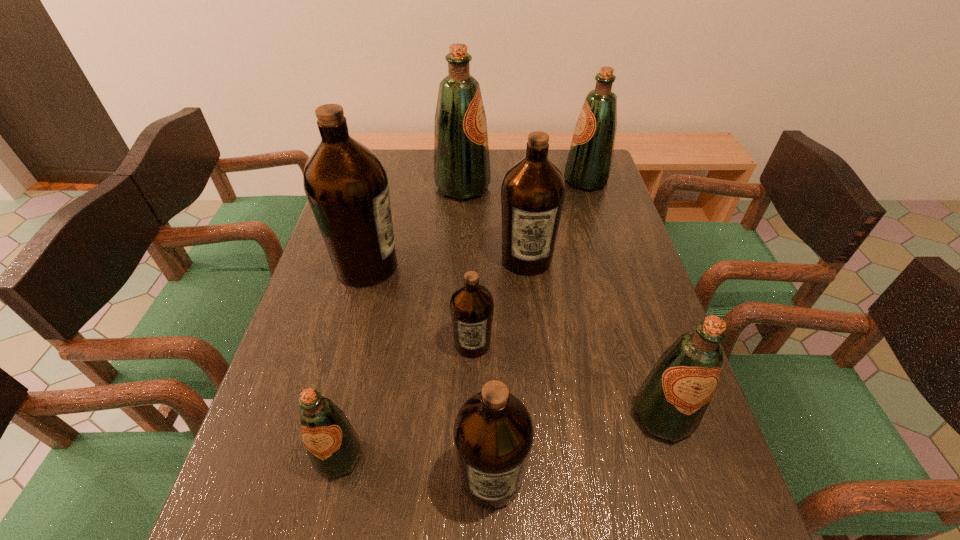
The height and width of the screenshot is (540, 960). What are the coordinates of `the biggest green olive oil` in the screenshot? It's located at (461, 153).

You are a GUI agent. You are given a task and a screenshot of the screen. Output one action in this format:
    pyautogui.click(x=<x>, y=<y>)
    Task: Click on the biggest brown olive oil
    The image size is (960, 540).
    Given the screenshot: What is the action you would take?
    pyautogui.click(x=345, y=182)

The height and width of the screenshot is (540, 960). Identify the location of the third smallest brown olive oil. (533, 191).

Find the location of a particular element. the third smallest green olive oil is located at coordinates (588, 167).

Where is `the nearest brown olive oil`? This screenshot has height=540, width=960. the nearest brown olive oil is located at coordinates (493, 432).

In order to click on the third biggest green olive oil in this screenshot , I will do `click(671, 402)`.

Where is `the smallest brown olive oil`? the smallest brown olive oil is located at coordinates (471, 305).

Where is `the third farthest brown olive oil`? the third farthest brown olive oil is located at coordinates (471, 305).

Image resolution: width=960 pixels, height=540 pixels. In order to click on the smallest green olive oil in this screenshot , I will do `click(333, 446)`.

You are a GUI agent. You are given a task and a screenshot of the screen. Output one action in this format:
    pyautogui.click(x=<x>, y=<y>)
    Task: Click on the vacant region located on the front-facing side of the second green olive oil from left to right
    
    Given the screenshot: What is the action you would take?
    point(576,188)